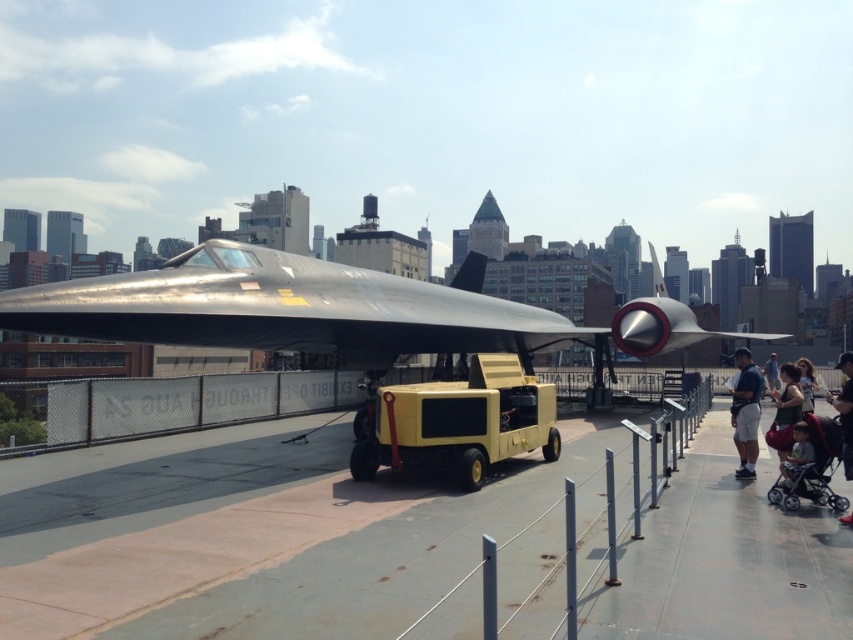
Question: Can you confirm if shiny metallic airplane at center is bigger than matte black stroller at lower right?

Choices:
 (A) no
 (B) yes

Answer: (B)

Question: Considering the real-world distances, which object is closest to the light brown leather jacket at center?

Choices:
 (A) matte black stroller at lower right
 (B) light brown fabric stroller at lower right
 (C) dark brown hair at center
 (D) dark blue jeans at center

Answer: (A)

Question: Is light brown fabric stroller at lower right positioned at the back of light brown leather jacket at center?

Choices:
 (A) yes
 (B) no

Answer: (B)

Question: Which of the following is the closest to the observer?

Choices:
 (A) dark blue jeans at center
 (B) shiny metallic airplane at center
 (C) dark brown hair at center

Answer: (B)

Question: Can you confirm if shiny metallic airplane at center is positioned above matte black stroller at lower right?

Choices:
 (A) no
 (B) yes

Answer: (B)

Question: Based on their relative distances, which object is farther from the dark brown hair at center?

Choices:
 (A) light brown leather jacket at center
 (B) yellow rubber tarmac at center
 (C) dark blue jeans at center
 (D) light brown fabric stroller at lower right

Answer: (A)